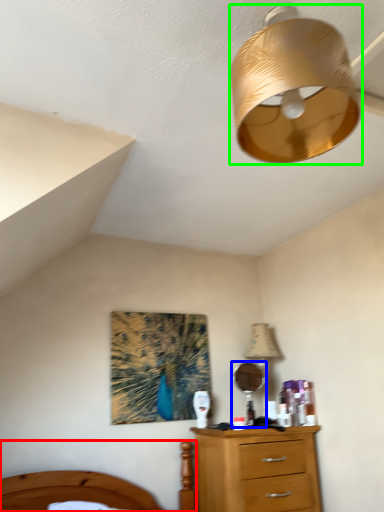
Question: Based on their relative distances, which object is nearer to bed (highlighted by a red box)? Choose from mirror (highlighted by a blue box) and lamp (highlighted by a green box).

Choices:
 (A) mirror
 (B) lamp

Answer: (A)